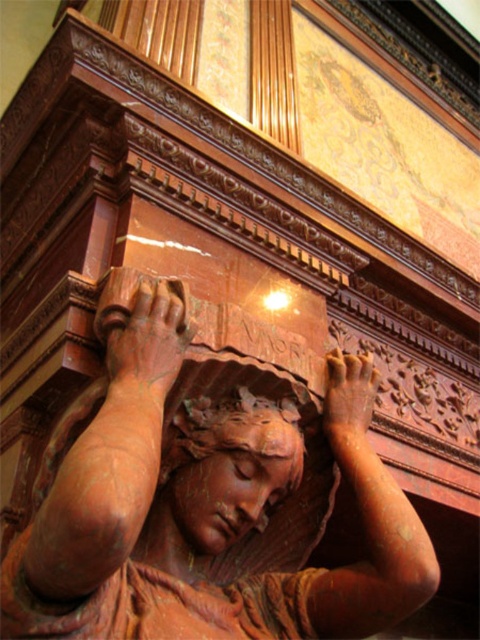
Who is lower down, rustic terracotta statue at center or matte terracotta head at center?

rustic terracotta statue at center

Measure the distance between rustic terracotta statue at center and matte terracotta head at center.

A distance of 35.77 inches exists between rustic terracotta statue at center and matte terracotta head at center.

Find the location of `rustic terracotta statue at center`. rustic terracotta statue at center is located at coordinates (196, 509).

In order to click on rustic terracotta statue at center in this screenshot , I will do `click(196, 509)`.

Based on the photo, how much distance is there between rustic terracotta statue at center and rustic wood hand at center?

rustic terracotta statue at center is 1.89 meters away from rustic wood hand at center.

Does rustic terracotta statue at center have a smaller size compared to rustic wood hand at center?

Actually, rustic terracotta statue at center might be larger than rustic wood hand at center.

The height and width of the screenshot is (640, 480). What do you see at coordinates (196, 509) in the screenshot?
I see `rustic terracotta statue at center` at bounding box center [196, 509].

Identify the location of rustic terracotta statue at center. This screenshot has width=480, height=640. (196, 509).

Between rustic terracotta statue at center and brown wood hand at center, which one appears on the left side from the viewer's perspective?

rustic terracotta statue at center is more to the left.

Which is behind, point (81, 476) or point (343, 385)?

The point (343, 385) is behind.

The height and width of the screenshot is (640, 480). What are the coordinates of `rustic terracotta statue at center` in the screenshot? It's located at (196, 509).

Where is `rustic terracotta statue at center`? The image size is (480, 640). rustic terracotta statue at center is located at coordinates (196, 509).